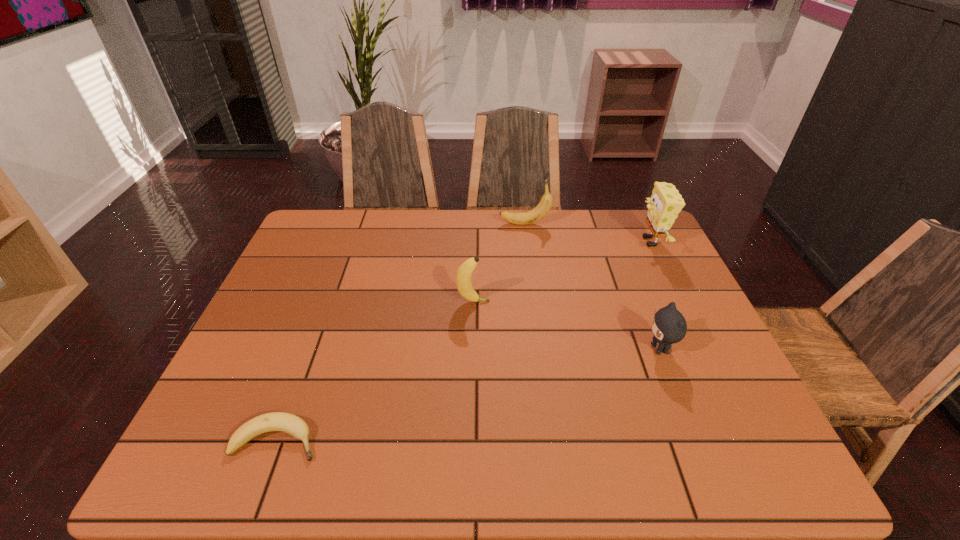
In the image, there is a desktop. In order to click on free space at the left edge in this screenshot , I will do `click(305, 338)`.

This screenshot has width=960, height=540. I want to click on vacant point at the right edge, so point(683,408).

Where is `vacant area at the far right corner of the desktop`? vacant area at the far right corner of the desktop is located at coordinates 628,249.

Identify the location of free spot between the farthest banana and the leftmost object. (400, 332).

You are a GUI agent. You are given a task and a screenshot of the screen. Output one action in this format:
    pyautogui.click(x=<x>, y=<y>)
    Task: Click on the free space between the second object from left to right and the farthest banana
    
    Given the screenshot: What is the action you would take?
    pyautogui.click(x=499, y=263)

Identify the location of unoccupied position between the sponge and the kitten. (656, 295).

Image resolution: width=960 pixels, height=540 pixels. What are the coordinates of `vacant area that lies between the kitten and the sponge` in the screenshot? It's located at (656, 295).

Find the location of a particular element. This screenshot has height=540, width=960. vacant space in between the rightmost banana and the second object from left to right is located at coordinates (499, 263).

Where is `free space between the third object from left to right and the third farthest object`? This screenshot has height=540, width=960. free space between the third object from left to right and the third farthest object is located at coordinates (499, 263).

This screenshot has height=540, width=960. In order to click on free area in between the kitten and the leftmost banana in this screenshot , I will do `click(468, 395)`.